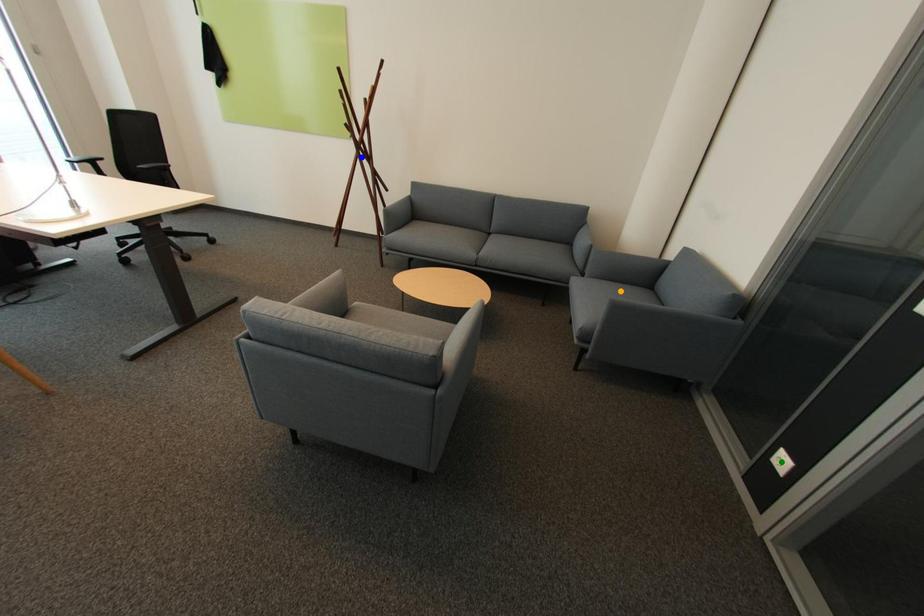
Order these from nearest to farthest:
A) green point
B) orange point
C) blue point

blue point → orange point → green point